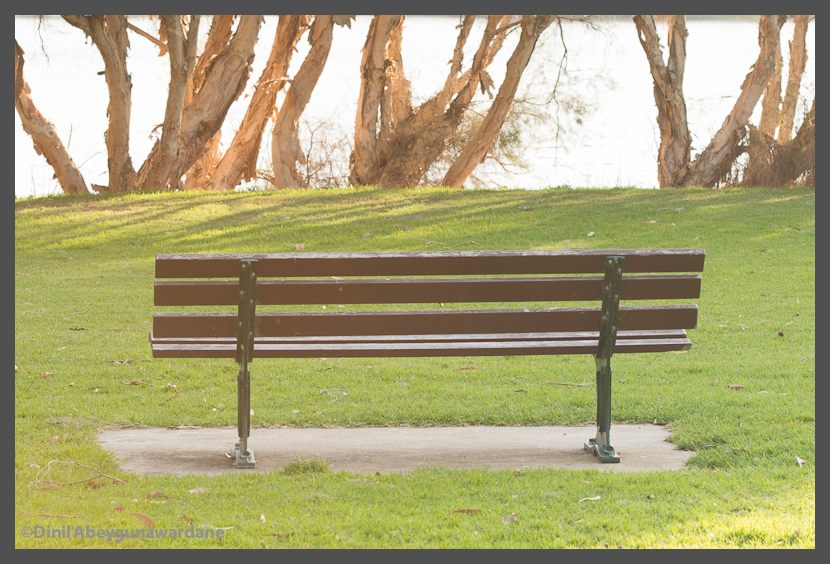
Find the location of a particular element. bench is located at coordinates (403, 295).